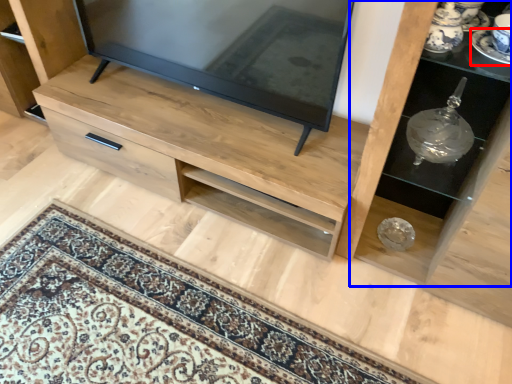
Question: Among these objects, which one is farthest to the camera, saucer (highlighted by a red box) or shelf (highlighted by a blue box)?

Choices:
 (A) saucer
 (B) shelf

Answer: (A)